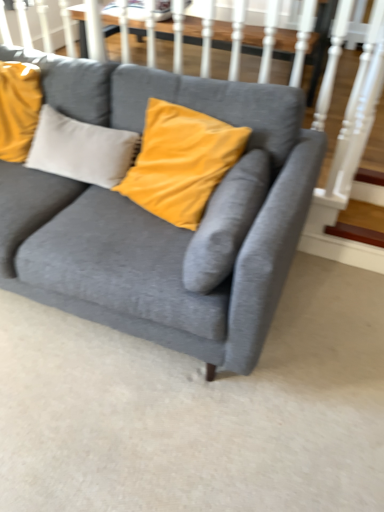
Question: In terms of size, does wooden stairs at lower right appear bigger or smaller than velvet gray couch at center?

Choices:
 (A) big
 (B) small

Answer: (B)

Question: Relative to velvet gray couch at center, is wooden stairs at lower right in front or behind?

Choices:
 (A) behind
 (B) front

Answer: (A)

Question: In terms of height, does wooden stairs at lower right look taller or shorter compared to velvet gray couch at center?

Choices:
 (A) tall
 (B) short

Answer: (B)

Question: Would you say velvet gray couch at center is inside or outside wooden stairs at lower right?

Choices:
 (A) inside
 (B) outside

Answer: (B)

Question: From the image's perspective, is velvet gray couch at center above or below wooden stairs at lower right?

Choices:
 (A) below
 (B) above

Answer: (B)

Question: Considering the positions of velvet gray couch at center and wooden stairs at lower right in the image, is velvet gray couch at center bigger or smaller than wooden stairs at lower right?

Choices:
 (A) small
 (B) big

Answer: (B)

Question: Visually, is velvet gray couch at center positioned to the left or to the right of wooden stairs at lower right?

Choices:
 (A) right
 (B) left

Answer: (B)